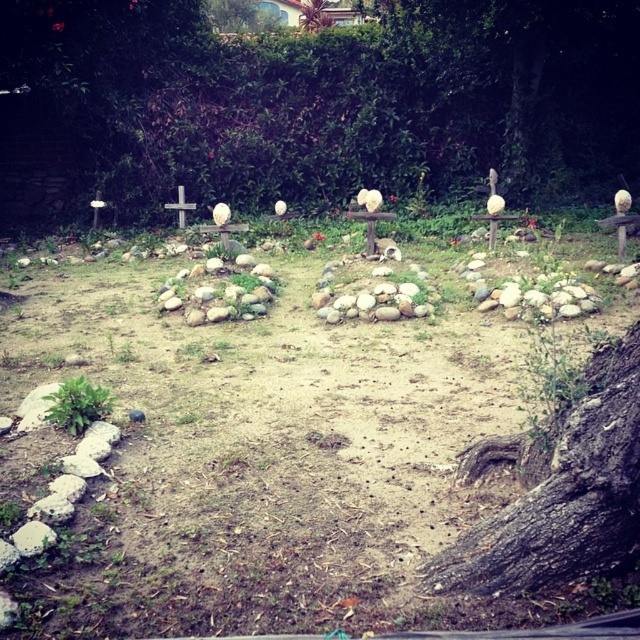
You are standing in the rustic outdoor area and notice two green leafy trees in the background. Which tree, the green leafy tree at center or the green leafy tree at upper center, is located to the right of the other?

The green leafy tree at center is positioned on the right side of green leafy tree at upper center.

You are standing in the outdoor area and want to place a small flag at the base of the white wooden cross at center. However, there is a green leafy tree at center above it. Do you think the flag will be visible from below the tree?

The green leafy tree at center is positioned over the white wooden cross at center, so the flag placed at the base of the white wooden cross at center might be partially obscured by the tree branches and leaves, making it less visible from below.

You are standing in the middle of the rustic outdoor area and want to take a photo of the green leafy tree at upper center. To ensure it is centered in your camera frame, should you move left or right?

The green leafy tree at upper center is located at coordinates approximately 0.025 on the horizontal axis, which is slightly to the left side of the image. To center it in your camera frame, you should move slightly to the right to adjust the position.